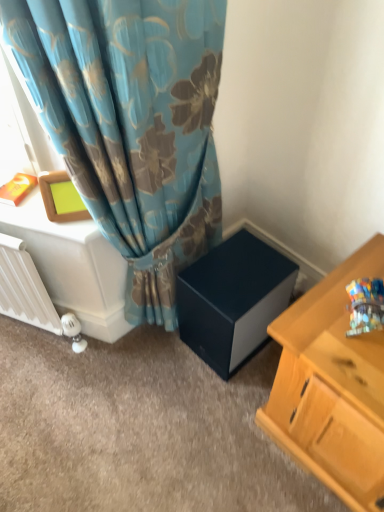
Find the location of `empty space that is to the right of white matte radiator at lower left`. empty space that is to the right of white matte radiator at lower left is located at coordinates (114, 361).